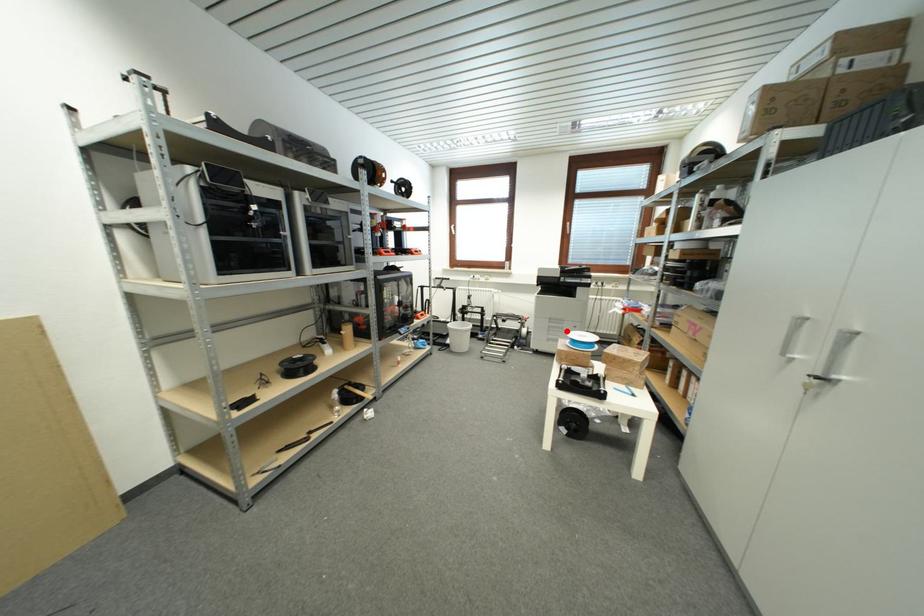
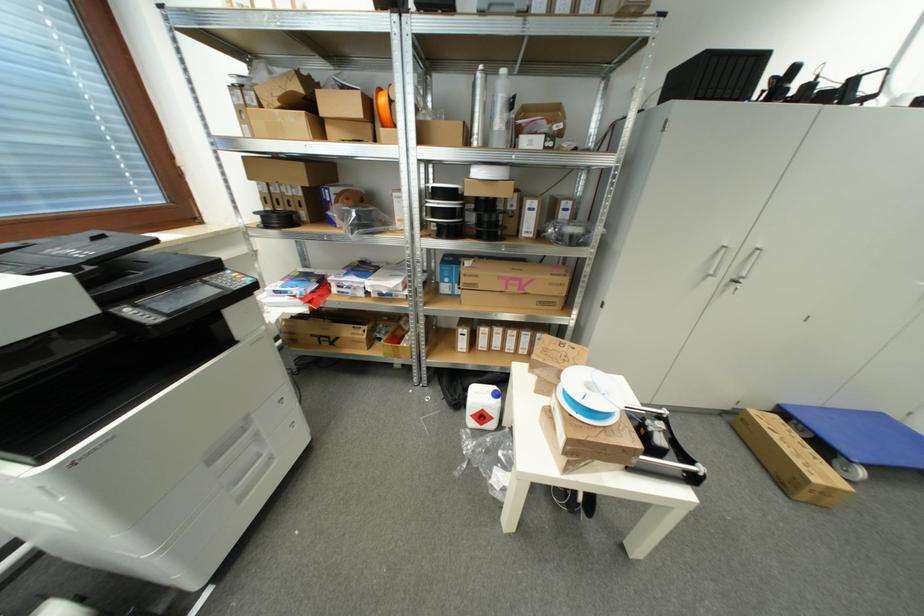
The point at the highlighted location is marked in the first image. Where is the corresponding point in the second image?

(261, 438)